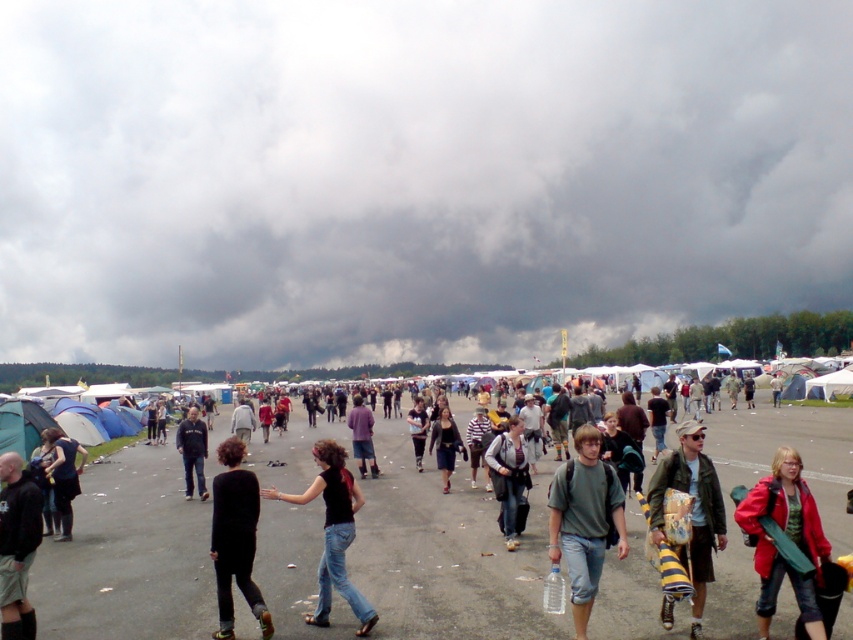
You are a photographer at the festival and want to take a photo of the two people wearing the dark gray fabric jacket at center and the purple cotton shirt at center. Which one should you focus on first if you want to capture the taller person in the frame?

The purple cotton shirt at center is taller than the dark gray fabric jacket at center, so you should focus on the person wearing the purple cotton shirt at center first to capture the taller individual.